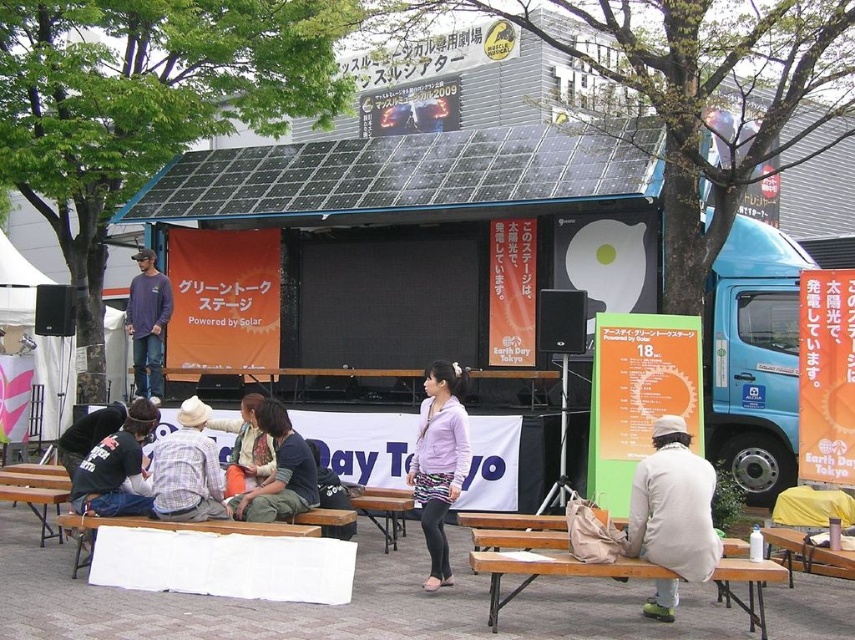
Question: Based on their relative distances, which object is nearer to the matte blue shirt at center?

Choices:
 (A) white cotton jacket at lower right
 (B) purple matte jacket at center
 (C) wooden park bench at lower right

Answer: (B)

Question: Based on their relative distances, which object is nearer to the purple matte jacket at center?

Choices:
 (A) white cotton jacket at lower right
 (B) matte blue shirt at center
 (C) orange fabric jacket at center

Answer: (A)

Question: Does black solar panel at center have a lesser width compared to black cotton shirt at lower left?

Choices:
 (A) no
 (B) yes

Answer: (B)

Question: Is purple matte jacket at center below plaid shirt at center?

Choices:
 (A) no
 (B) yes

Answer: (B)

Question: Can you confirm if matte black jacket at center is wider than matte blue shirt at center?

Choices:
 (A) yes
 (B) no

Answer: (B)

Question: Which point appears closest to the camera in this image?

Choices:
 (A) (149, 314)
 (B) (262, 426)
 (C) (83, 442)
 (D) (245, 428)

Answer: (B)